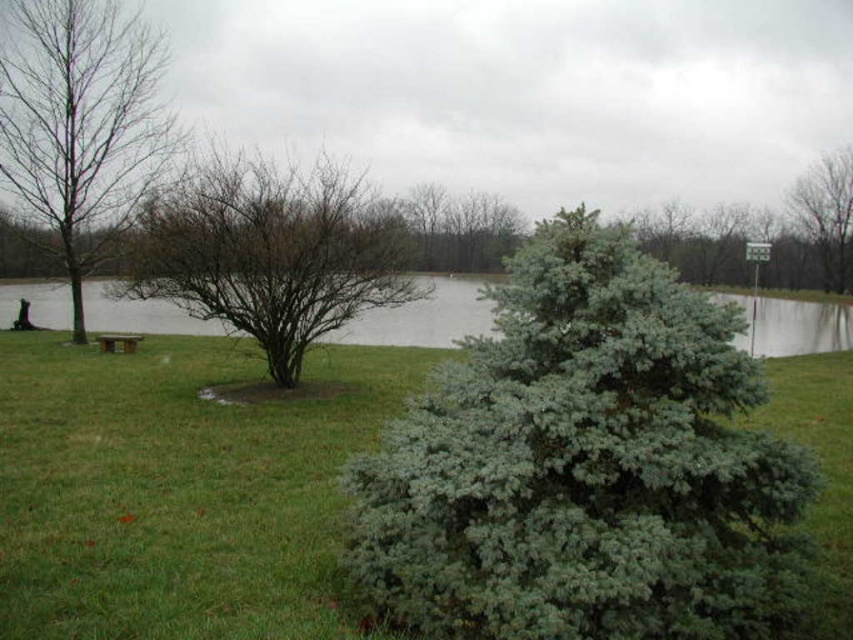
Is green grassy at center wider than wooden park bench at left?

Yes.

Between green grassy at center and wooden park bench at left, which one is positioned higher?

wooden park bench at left is above.

Where is `green grassy at center`? The height and width of the screenshot is (640, 853). green grassy at center is located at coordinates (180, 488).

Locate an element on the screen. green grassy at center is located at coordinates (180, 488).

Is green textured bush at center thinner than brown leafless tree at upper right?

Incorrect, green textured bush at center's width is not less than brown leafless tree at upper right's.

Is green textured bush at center further to camera compared to brown leafless tree at upper right?

No, green textured bush at center is in front of brown leafless tree at upper right.

Image resolution: width=853 pixels, height=640 pixels. Identify the location of green textured bush at center. (460, 228).

You are a GUI agent. You are given a task and a screenshot of the screen. Output one action in this format:
    pyautogui.click(x=<x>, y=<y>)
    Task: Click on the green textured bush at center
    The width and height of the screenshot is (853, 640).
    Given the screenshot: What is the action you would take?
    pyautogui.click(x=460, y=228)

Consider the image. Who is taller, clear water at center or wooden park bench at left?

clear water at center is taller.

Can you confirm if clear water at center is bigger than wooden park bench at left?

Yes.

The width and height of the screenshot is (853, 640). In order to click on clear water at center in this screenshot , I will do (x=422, y=317).